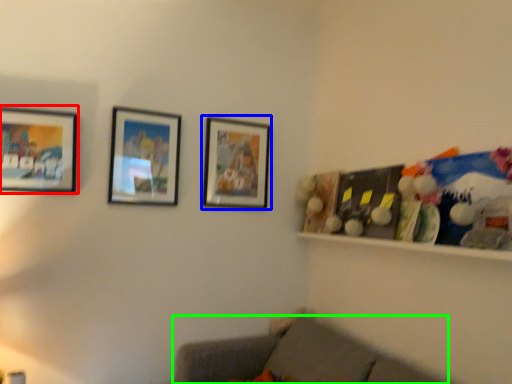
Question: Estimate the real-world distances between objects in this image. Which object is farther from picture frame (highlighted by a red box), picture frame (highlighted by a blue box) or studio couch (highlighted by a green box)?

Choices:
 (A) picture frame
 (B) studio couch

Answer: (B)